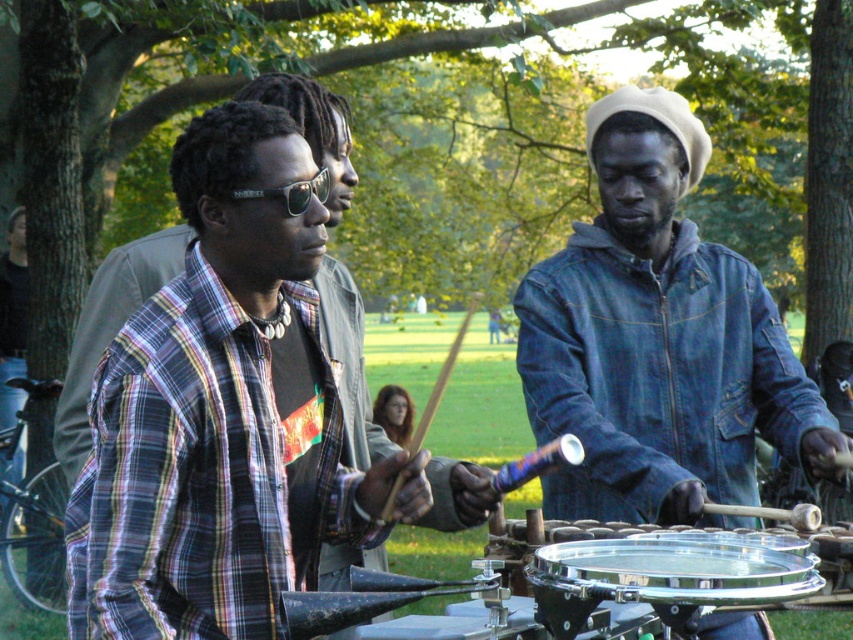
Question: Is denim jacket at center above shiny metallic drum at center?

Choices:
 (A) yes
 (B) no

Answer: (A)

Question: Does denim jacket at center have a larger size compared to shiny metallic drum at center?

Choices:
 (A) yes
 (B) no

Answer: (A)

Question: Among these objects, which one is farthest from the camera?

Choices:
 (A) shiny metallic drum at center
 (B) denim jacket at center

Answer: (B)

Question: Which point is farther to the camera?

Choices:
 (A) shiny metallic drum at center
 (B) denim jacket at center

Answer: (B)

Question: Is denim jacket at center in front of shiny metallic drum at center?

Choices:
 (A) no
 (B) yes

Answer: (A)